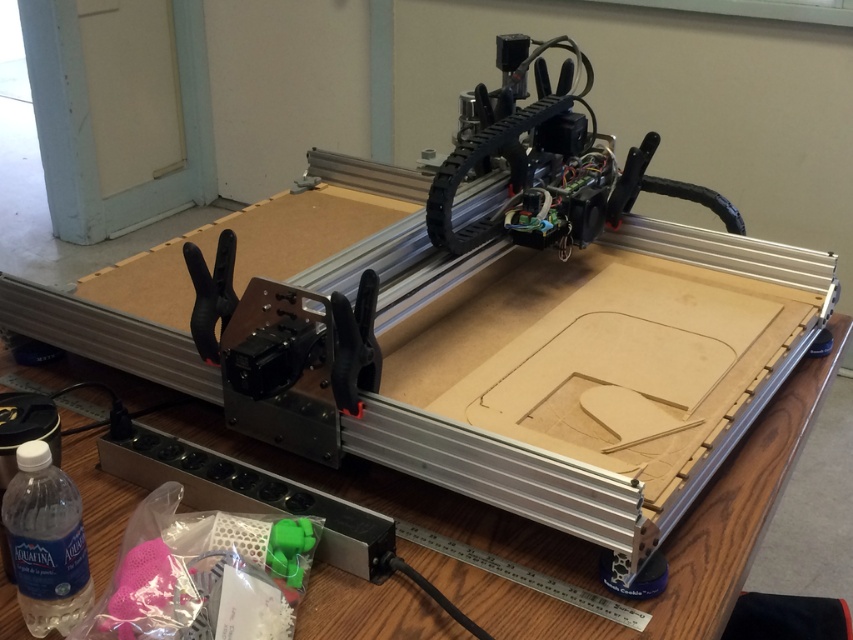
Between point (751, 416) and point (15, 573), which one is positioned behind?

Positioned behind is point (751, 416).

Is point (479, 442) farther from camera compared to point (55, 550)?

Yes.

Which is behind, point (724, 445) or point (42, 563)?

The point (724, 445) is behind.

Find the location of a particular element. wooden table at center is located at coordinates (498, 472).